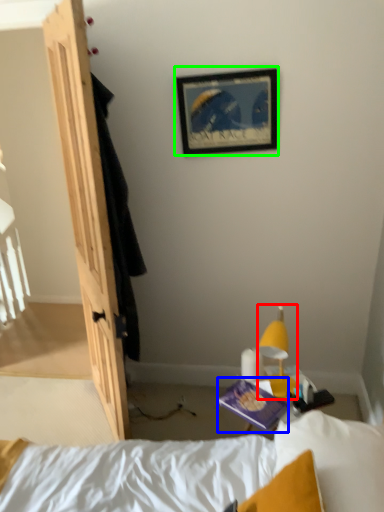
Question: Which is nearer to the light fixture (highlighted by a red box)? paperback book (highlighted by a blue box) or picture frame (highlighted by a green box).

Choices:
 (A) paperback book
 (B) picture frame

Answer: (A)